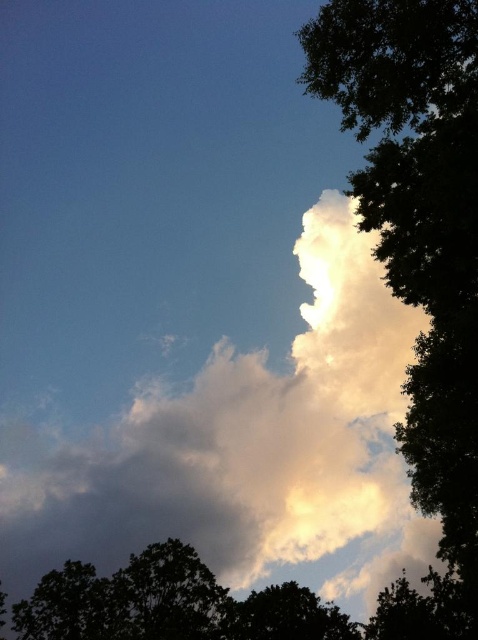
You are an astronomer analyzing the sky and notice the white fluffy cloud at upper center. Based on its position at coordinates 0.698, 0.510, can you determine if it is closer to the top or bottom of the image?

The white fluffy cloud at upper center is located at point (243,445), which places it closer to the top of the image since the y coordinate 0.510 is above the midpoint of the image.

Based on the photo, you are an observer looking at the sky scene. There are two green leafy trees in the image. Which tree is closer to you, the green leafy tree at upper right or the green leafy tree at lower right?

The green leafy tree at upper right is closer to you because it is positioned in front of the green leafy tree at lower right.